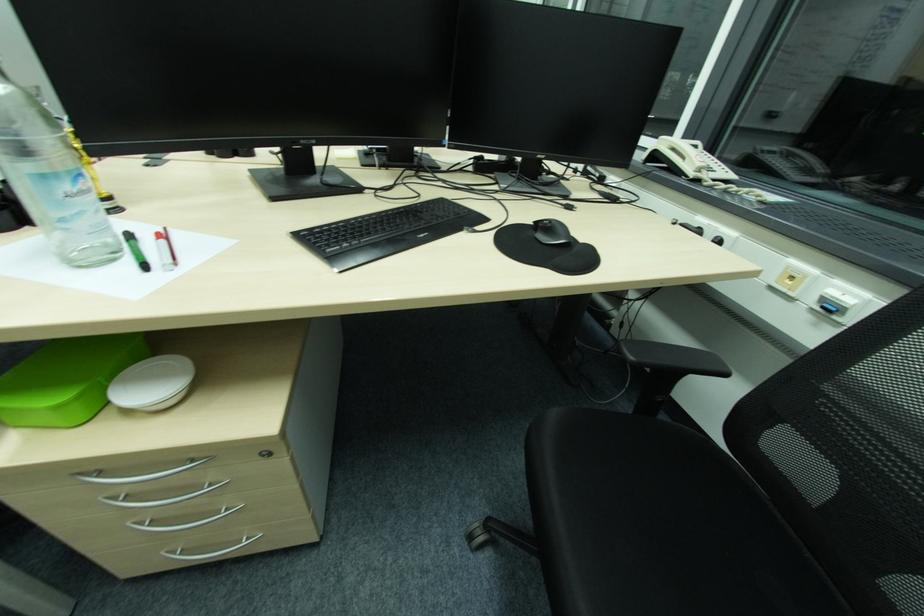
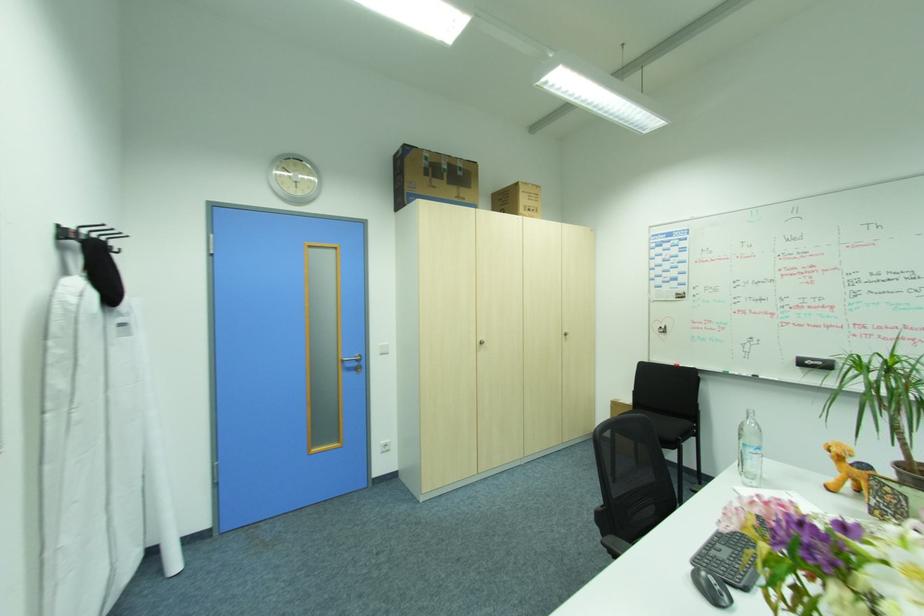
Question: The images are taken continuously from a first-person perspective. In which direction is your viewpoint rotating?

Choices:
 (A) Left
 (B) Right
 (C) Up
 (D) Down

Answer: (A)